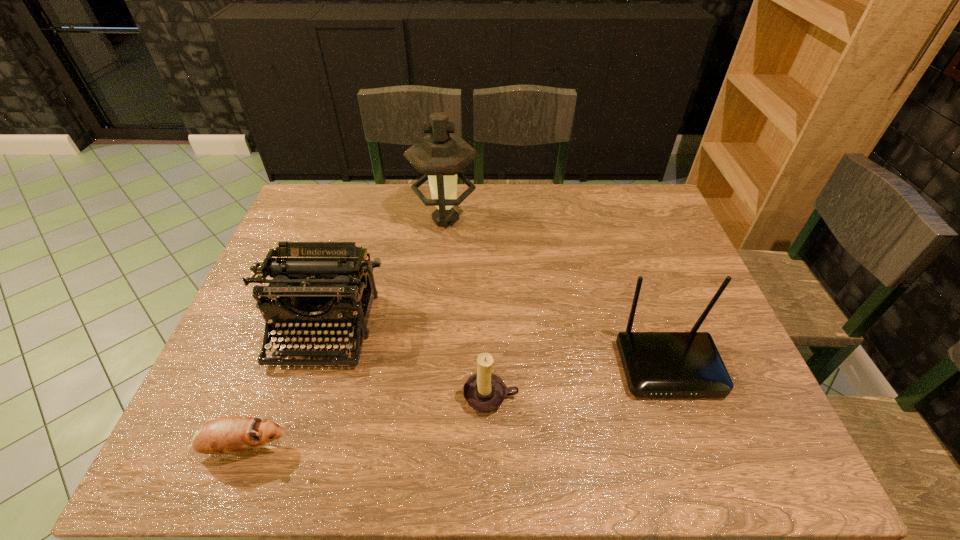
Where is `the farthest object`? the farthest object is located at coordinates (439, 156).

Where is `oil lamp`? Image resolution: width=960 pixels, height=540 pixels. oil lamp is located at coordinates (439, 156).

Image resolution: width=960 pixels, height=540 pixels. I want to click on the rightmost object, so click(x=656, y=364).

This screenshot has height=540, width=960. I want to click on typewriter, so click(x=317, y=284).

The image size is (960, 540). I want to click on the second shortest object, so click(x=484, y=391).

Where is `the nearest object`? the nearest object is located at coordinates (224, 435).

Locate an element on the screen. The height and width of the screenshot is (540, 960). hamster is located at coordinates [x=224, y=435].

The width and height of the screenshot is (960, 540). I want to click on free space located on the left of the tallest object, so pyautogui.click(x=390, y=219).

This screenshot has width=960, height=540. In order to click on vacant region located 0.210m on the typing side of the typewriter in this screenshot , I will do `click(281, 461)`.

Where is `free spot located 0.050m on the wick of the second shortest object`? free spot located 0.050m on the wick of the second shortest object is located at coordinates (492, 440).